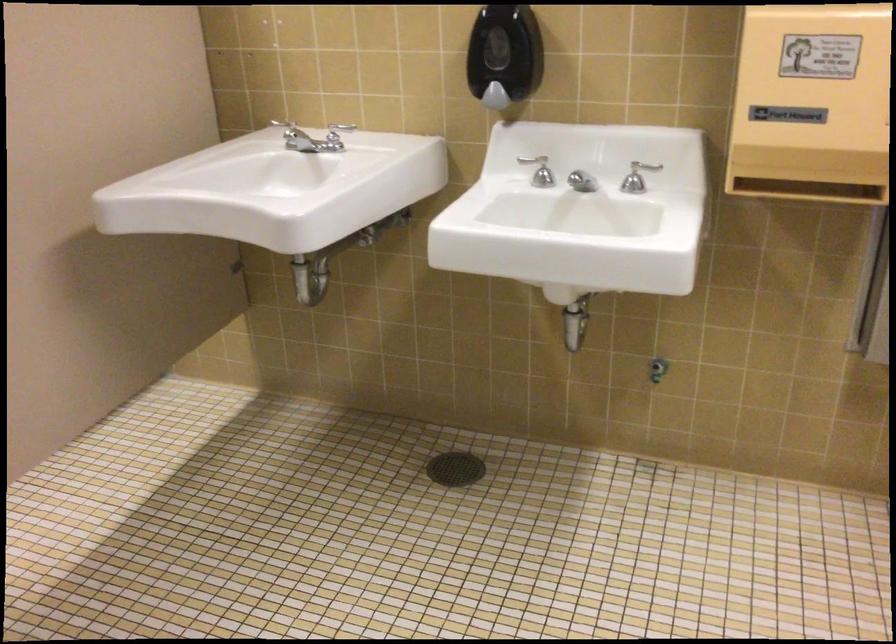
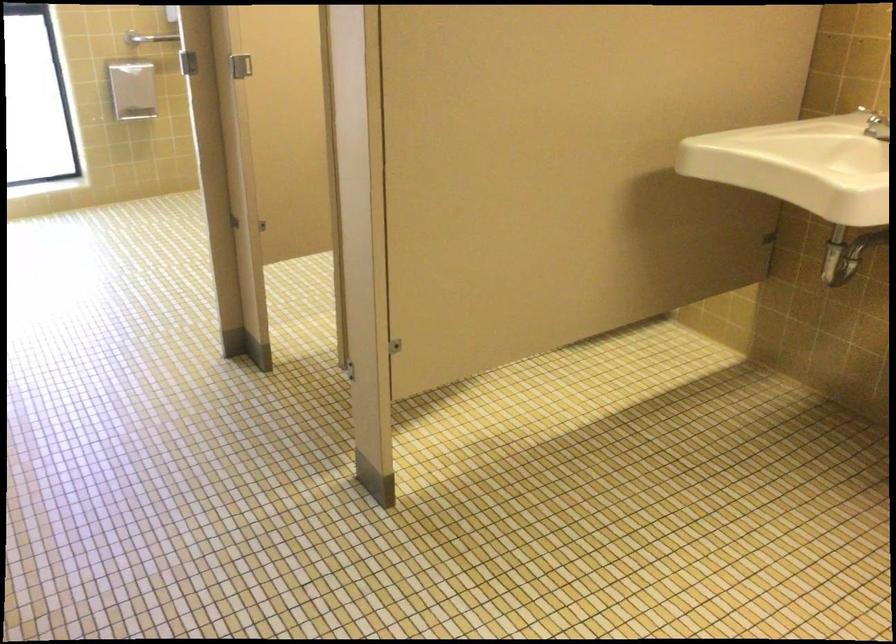
Question: The camera is either moving clockwise (left) or counter-clockwise (right) around the object. The first image is from the beginning of the video and the second image is from the end. Is the camera moving left or right when shooting the video?

Choices:
 (A) Left
 (B) Right

Answer: (B)